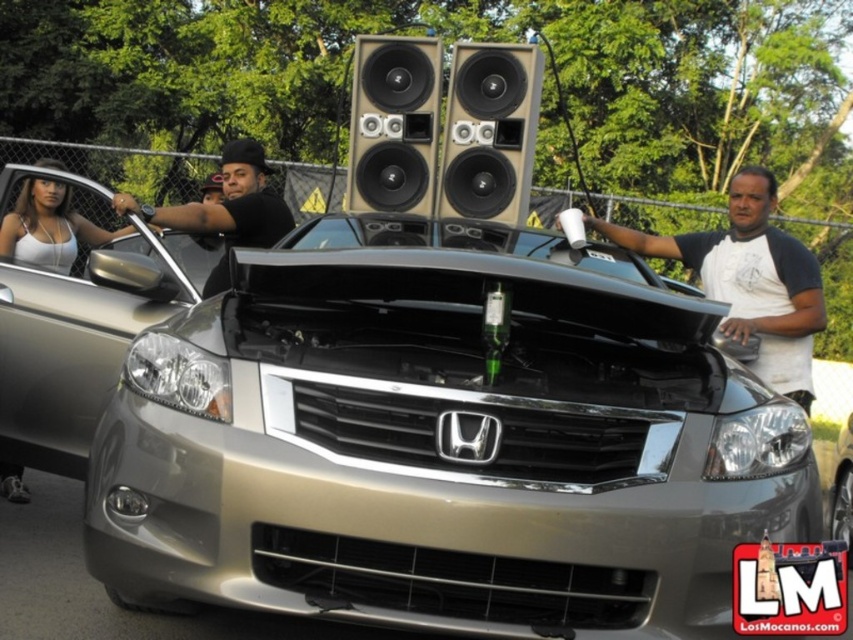
Who is taller, white cotton t-shirt at center or matte white tank top at left?

Standing taller between the two is white cotton t-shirt at center.

Can you confirm if white cotton t-shirt at center is positioned to the right of matte white tank top at left?

Correct, you'll find white cotton t-shirt at center to the right of matte white tank top at left.

This screenshot has width=853, height=640. What do you see at coordinates (750, 280) in the screenshot?
I see `white cotton t-shirt at center` at bounding box center [750, 280].

Where is `white cotton t-shirt at center`? This screenshot has height=640, width=853. white cotton t-shirt at center is located at coordinates (750, 280).

Between satin silver car at center and matte white tank top at left, which one appears on the right side from the viewer's perspective?

satin silver car at center

What do you see at coordinates (442, 449) in the screenshot?
I see `satin silver car at center` at bounding box center [442, 449].

The height and width of the screenshot is (640, 853). In order to click on satin silver car at center in this screenshot , I will do `click(442, 449)`.

Is point (772, 262) positioned before point (401, 61)?

Yes.

Who is more distant from viewer, (811, 394) or (434, 150)?

Point (434, 150)

The width and height of the screenshot is (853, 640). Identify the location of white cotton t-shirt at center. (750, 280).